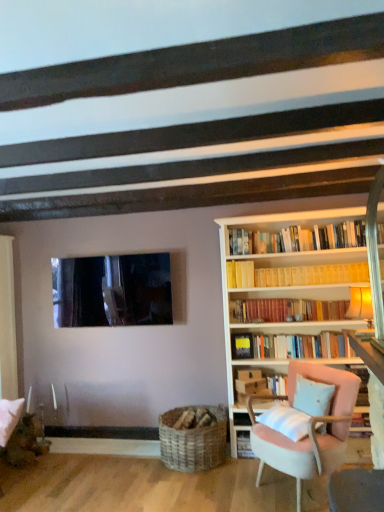
Question: From a real-world perspective, is yellow paperbacks at upper center, the 2th book ordered from the bottom, above or below pink fabric chair at right?

Choices:
 (A) below
 (B) above

Answer: (B)

Question: Is yellow paperbacks at upper center, acting as the first book starting from the top, spatially inside pink fabric chair at right, or outside of it?

Choices:
 (A) inside
 (B) outside

Answer: (B)

Question: Considering the real-world distances, which object is farthest from the woven wood basket at lower center?

Choices:
 (A) light blue fabric pillow at lower right
 (B) transparent glass window at upper center
 (C) hardcover books at center, placed as the first book when sorted from bottom to top
 (D) yellow paperbacks at upper center, acting as the first book starting from the top
 (E) pink fabric chair at right

Answer: (D)

Question: Estimate the real-world distances between objects in this image. Which object is farther from the hardcover books at center, acting as the second book starting from the top?

Choices:
 (A) woven wood basket at lower center
 (B) light blue fabric pillow at lower right
 (C) transparent glass window at upper center
 (D) pink fabric chair at right
 (E) yellow paperbacks at upper center, acting as the first book starting from the top

Answer: (C)